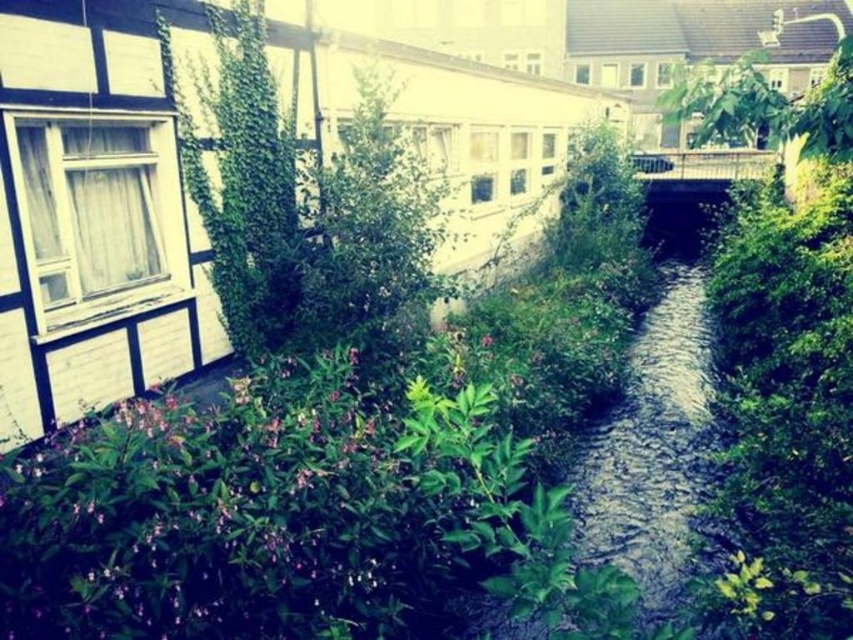
Can you confirm if green leafy plant at upper left is thinner than clear water stream at center?

Indeed, green leafy plant at upper left has a lesser width compared to clear water stream at center.

Is point (326, 205) closer to viewer compared to point (672, 342)?

Yes, point (326, 205) is in front of point (672, 342).

Is point (329, 218) positioned after point (612, 467)?

That is False.

The width and height of the screenshot is (853, 640). Identify the location of green leafy plant at upper left. (302, 204).

Measure the distance from green leafy bush at center-right to clear water stream at center.

green leafy bush at center-right is 6.35 feet away from clear water stream at center.

Can you confirm if green leafy bush at center-right is smaller than clear water stream at center?

Yes, green leafy bush at center-right is smaller than clear water stream at center.

Find the location of `green leafy bush at center-right`. green leafy bush at center-right is located at coordinates (782, 360).

Where is `green leafy bush at center-right`? This screenshot has height=640, width=853. green leafy bush at center-right is located at coordinates (782, 360).

Who is higher up, green leafy bush at center-right or green leafy plant at upper left?

green leafy bush at center-right

Can you confirm if green leafy bush at center-right is wider than green leafy plant at upper left?

Correct, the width of green leafy bush at center-right exceeds that of green leafy plant at upper left.

Describe the element at coordinates (782, 360) in the screenshot. I see `green leafy bush at center-right` at that location.

The width and height of the screenshot is (853, 640). Identify the location of green leafy bush at center-right. (782, 360).